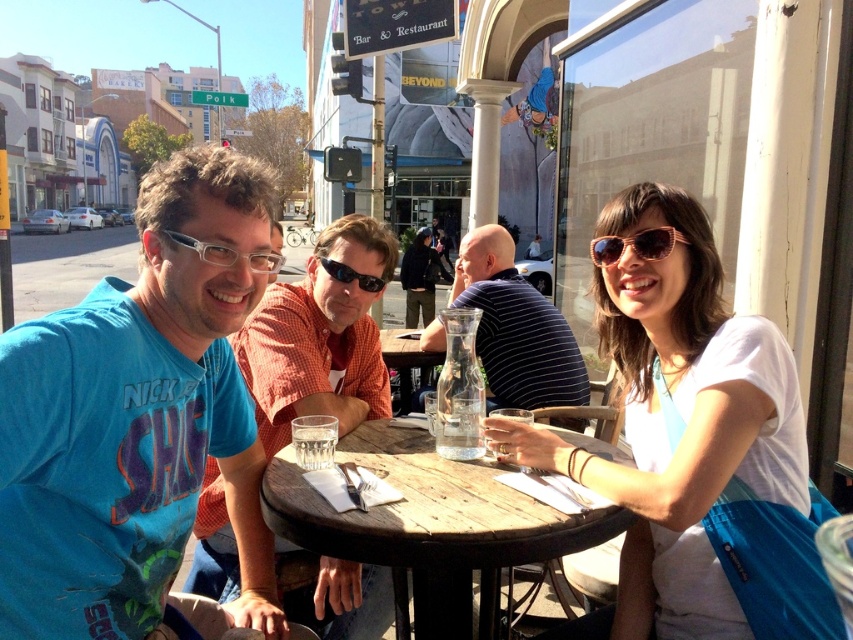
Can you confirm if orange checkered shirt at center is positioned to the right of pink acetate sunglasses at upper right?

No, orange checkered shirt at center is not to the right of pink acetate sunglasses at upper right.

In the scene shown: Does orange checkered shirt at center have a larger size compared to pink acetate sunglasses at upper right?

Yes, orange checkered shirt at center is bigger than pink acetate sunglasses at upper right.

Locate an element on the screen. Image resolution: width=853 pixels, height=640 pixels. orange checkered shirt at center is located at coordinates (318, 339).

Is striped cotton shirt at center shorter than clear glass at table center?

No, striped cotton shirt at center is not shorter than clear glass at table center.

Which is behind, point (483, 250) or point (326, 444)?

Point (483, 250)

Where is `striped cotton shirt at center`? striped cotton shirt at center is located at coordinates (515, 326).

Describe the element at coordinates (431, 524) in the screenshot. Image resolution: width=853 pixels, height=640 pixels. I see `wooden at center` at that location.

Is wooden at center positioned before clear plastic glasses at center?

Yes, wooden at center is closer to the viewer.

Is point (305, 516) positioned after point (224, 262)?

That is True.

This screenshot has height=640, width=853. I want to click on wooden at center, so click(x=431, y=524).